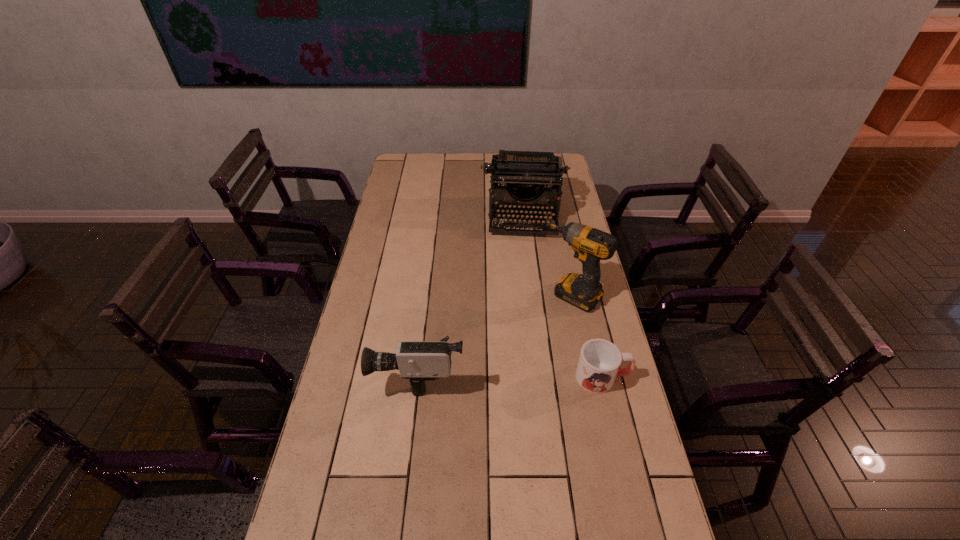
The image size is (960, 540). I want to click on camcorder, so [x=417, y=361].

The width and height of the screenshot is (960, 540). What are the coordinates of `the shortest object` in the screenshot? It's located at (599, 361).

This screenshot has width=960, height=540. Find the location of `the third nearest object`. the third nearest object is located at coordinates (584, 291).

Identify the location of drill. This screenshot has height=540, width=960. (584, 291).

You are a GUI agent. You are given a task and a screenshot of the screen. Output one action in this format:
    pyautogui.click(x=<x>, y=<y>)
    Task: Click on the farthest object
    The height and width of the screenshot is (540, 960).
    Given the screenshot: What is the action you would take?
    pyautogui.click(x=524, y=172)

This screenshot has width=960, height=540. What are the coordinates of `vacant area situated 0.050m on the recording direction of the leftmost object` in the screenshot? It's located at (360, 373).

The height and width of the screenshot is (540, 960). I want to click on vacant space located 0.090m on the recording direction of the leftmost object, so click(348, 373).

You are a GUI agent. You are given a task and a screenshot of the screen. Output one action in this format:
    pyautogui.click(x=<x>, y=<y>)
    Task: Click on the vacant region located 0.370m with the drill bit of the tallest object facing forward
    The image size is (960, 540).
    Given the screenshot: What is the action you would take?
    pyautogui.click(x=497, y=382)

The image size is (960, 540). Find the location of `vacant space located 0.180m with the drill bit of the tallest object facing forward`. vacant space located 0.180m with the drill bit of the tallest object facing forward is located at coordinates (530, 343).

This screenshot has height=540, width=960. I want to click on vacant point located 0.050m with the drill bit of the tallest object facing forward, so click(x=550, y=319).